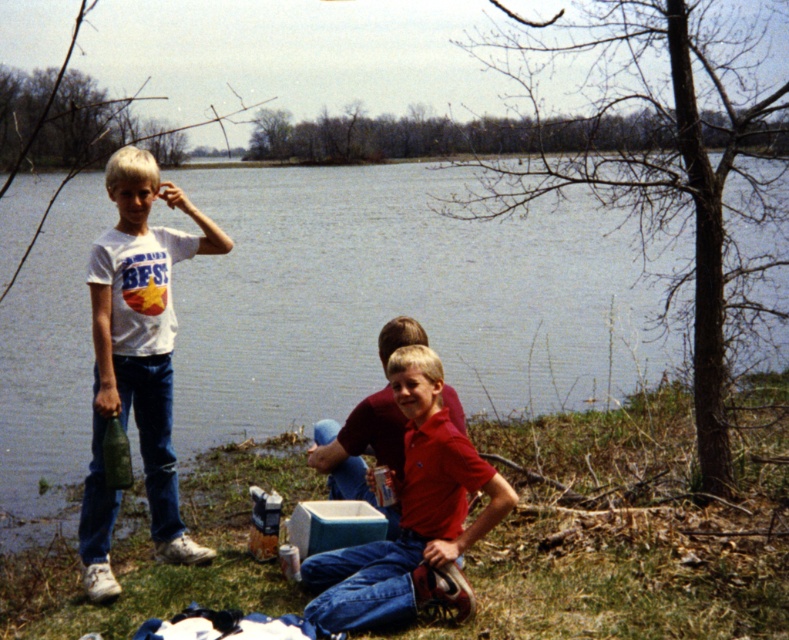
You are taking a photo of the blue water at center and the matte red shirt at center. Which object will appear closer to the camera in the photo?

The blue water at center appears closer to the camera than the matte red shirt at center because it is positioned further to the viewer.